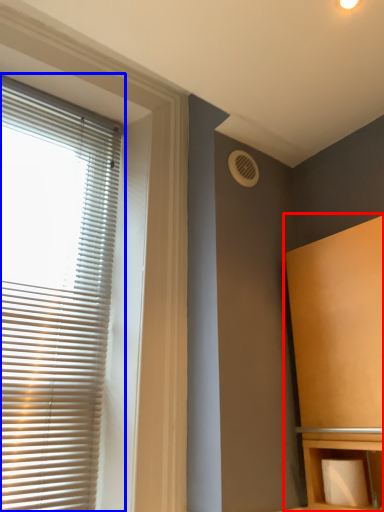
Question: Which object is closer to the camera taking this photo, furniture (highlighted by a red box) or window blind (highlighted by a blue box)?

Choices:
 (A) furniture
 (B) window blind

Answer: (A)